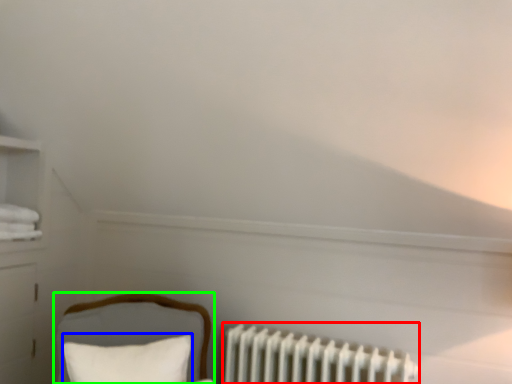
Question: Which object is positioned closest to radiator (highlighted by a red box)? Select from pillow (highlighted by a blue box) and furniture (highlighted by a green box).

Choices:
 (A) pillow
 (B) furniture

Answer: (B)